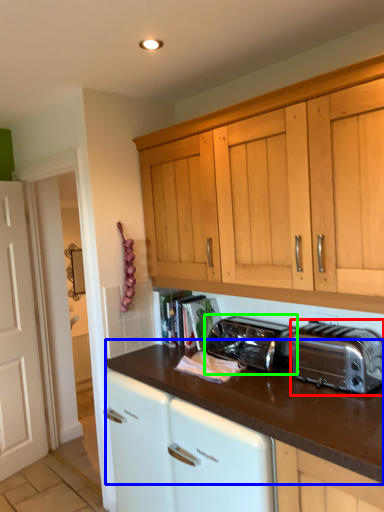
Question: Considering the real-world distances, which object is farthest from toaster (highlighted by a red box)? countertop (highlighted by a blue box) or toaster (highlighted by a green box)?

Choices:
 (A) countertop
 (B) toaster

Answer: (B)